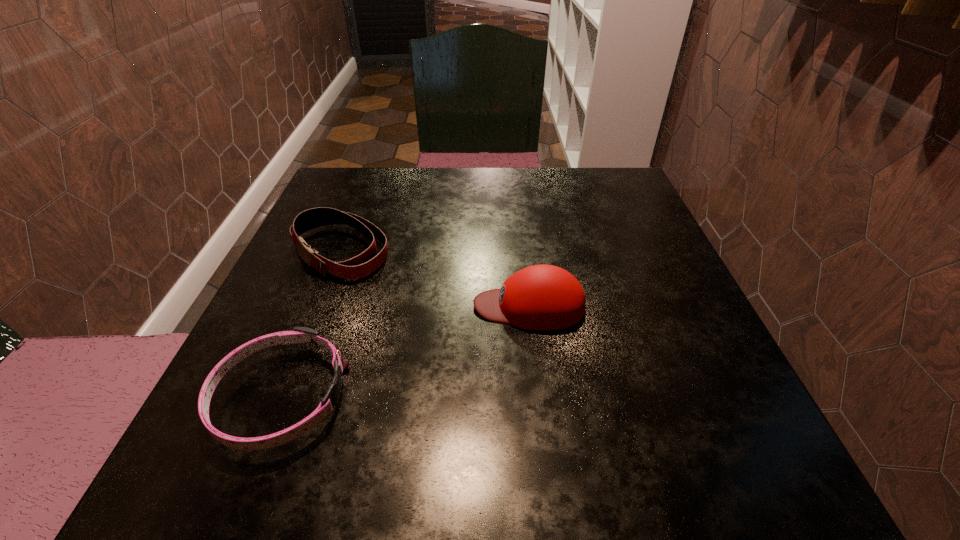
Where is `free space located with the buckle on the shorter dog collar`? free space located with the buckle on the shorter dog collar is located at coordinates (615, 397).

The width and height of the screenshot is (960, 540). I want to click on object located at the near edge, so click(x=299, y=334).

Image resolution: width=960 pixels, height=540 pixels. I want to click on object at the near left corner, so click(299, 334).

In the image, there is a desktop. Where is `vacant space at the far edge`? The image size is (960, 540). vacant space at the far edge is located at coordinates (526, 214).

Where is `blank space at the near edge of the desktop`? This screenshot has height=540, width=960. blank space at the near edge of the desktop is located at coordinates (434, 456).

The width and height of the screenshot is (960, 540). I want to click on vacant space at the left edge of the desktop, so click(297, 409).

Identify the location of vacant space at the right edge. This screenshot has height=540, width=960. (647, 261).

Locate an element on the screen. The image size is (960, 540). vacant space at the far left corner of the desktop is located at coordinates (x=372, y=210).

This screenshot has width=960, height=540. In the image, there is a desktop. What are the coordinates of `vacant area at the far right corner` in the screenshot? It's located at (616, 187).

In the image, there is a desktop. At what (x,y) coordinates should I click in order to perform the action: click on vacant space at the near right corner. Please return your answer as a coordinate pair (x, y). The width and height of the screenshot is (960, 540). Looking at the image, I should click on (788, 482).